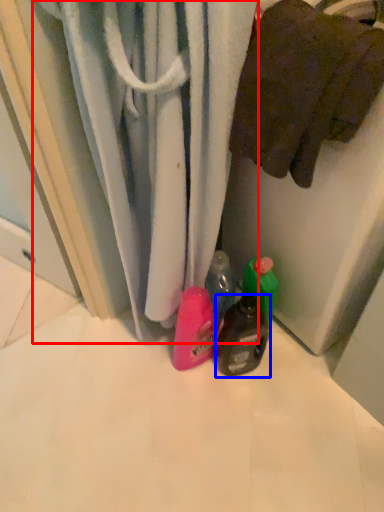
Question: Which point is further to the camera, curtain (highlighted by a red box) or bottle (highlighted by a blue box)?

Choices:
 (A) curtain
 (B) bottle

Answer: (B)